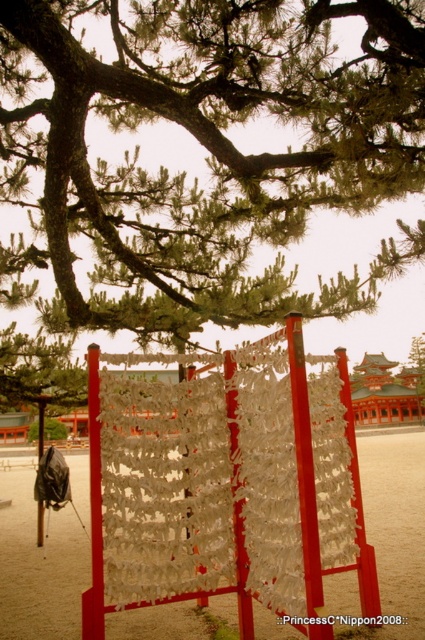
You are standing at the lower center of the scene. Looking up, you see the green leafy tree at upper center and the sandy beige sand at lower center. Which object is positioned to the left of the other?

The green leafy tree at upper center is positioned to the left of the sandy beige sand at lower center.

You are standing at the entrance of the shrine and see the green leafy tree at upper center and the sandy beige sand at lower center. Which object is closer to the ground?

The sandy beige sand at lower center is closer to the ground since it is located at the lower part of the scene, while the green leafy tree at upper center is positioned higher up.

You are standing in the Japanese shrine grounds and see the red wooden structure with lanterns. There is a point marked at coordinates (209, 150). Based on the scene, what is the location of this point relative to the green leafy tree at upper center?

The point (209, 150) is located on the green leafy tree at upper center.